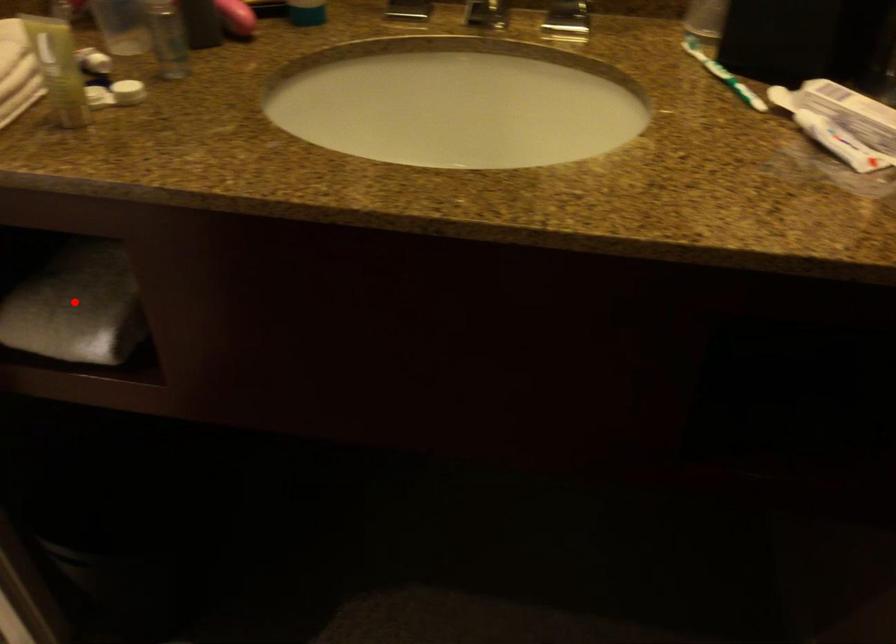
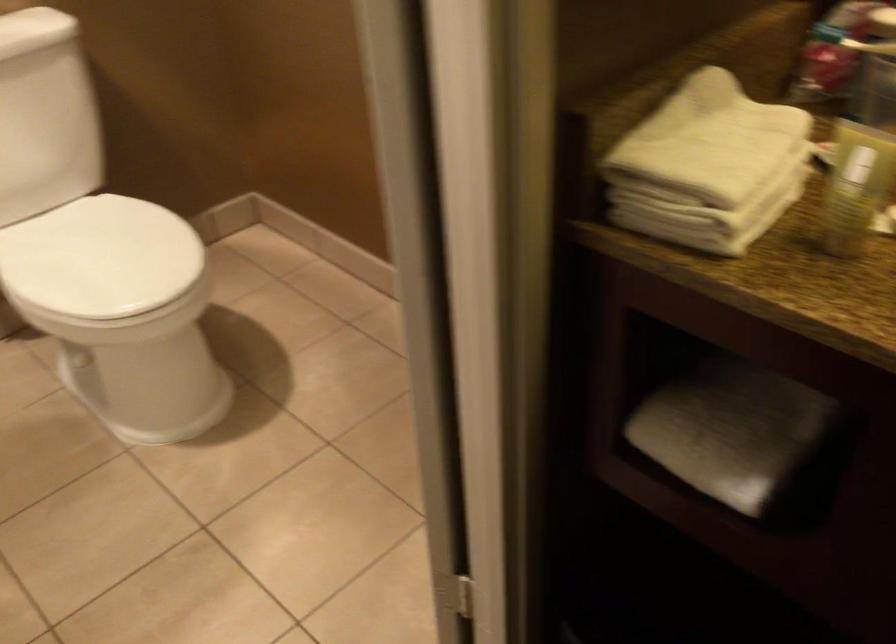
Locate, in the second image, the point that corresponds to the highlighted location in the first image.

(730, 431)